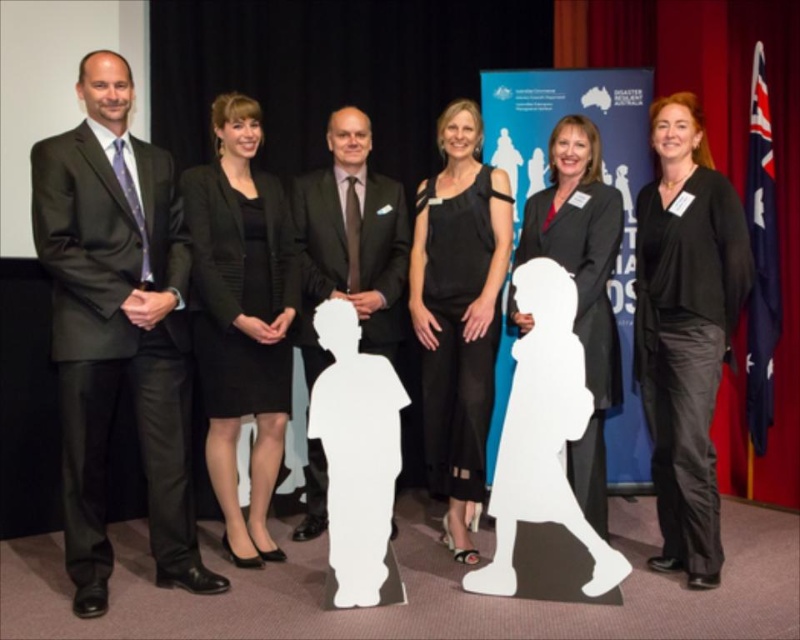
Question: Which point appears farthest from the camera in this image?

Choices:
 (A) (426, 246)
 (B) (360, 342)

Answer: (B)

Question: Does matte black suit at left appear on the left side of black satin dress at center?

Choices:
 (A) yes
 (B) no

Answer: (A)

Question: Which object appears farthest from the camera in this image?

Choices:
 (A) black matte suit at center
 (B) black satin blouse at right
 (C) matte black suit at left

Answer: (A)

Question: Which of these objects is positioned farthest from the matte black suit at center?

Choices:
 (A) black satin dress at center
 (B) matte black suit at left
 (C) black matte suit at center

Answer: (B)

Question: Can you confirm if matte black suit at left is bigger than matte black suit at center?

Choices:
 (A) yes
 (B) no

Answer: (A)

Question: Can you confirm if black textured blazer at center is positioned to the left of matte black suit at center?

Choices:
 (A) yes
 (B) no

Answer: (A)